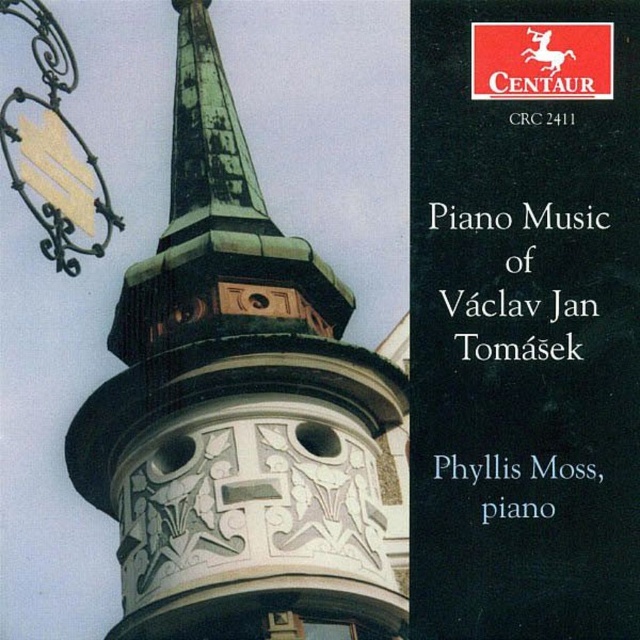
Question: Which point is closer to the camera?

Choices:
 (A) (444, 464)
 (B) (84, 426)
 (C) (196, 131)

Answer: (A)

Question: Which of these objects is positioned farthest from the metallic red horse at upper right?

Choices:
 (A) green patina tower at center
 (B) green patina spire at upper center
 (C) black paper at upper right

Answer: (B)

Question: Is green patina spire at upper center bigger than metallic red horse at upper right?

Choices:
 (A) yes
 (B) no

Answer: (A)

Question: Is green patina tower at center to the right of green patina spire at upper center from the viewer's perspective?

Choices:
 (A) yes
 (B) no

Answer: (A)

Question: Which is nearer to the black paper at upper right?

Choices:
 (A) green patina tower at center
 (B) metallic red horse at upper right

Answer: (B)

Question: Does green patina tower at center appear under black paper at upper right?

Choices:
 (A) yes
 (B) no

Answer: (B)